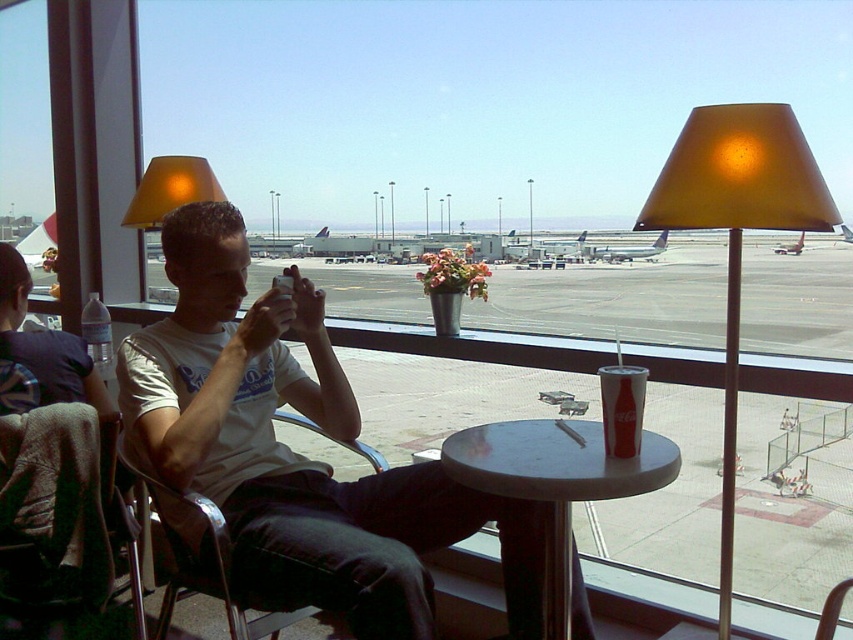
You are an airport photographer who needs to set up your equipment. You see the smooth gray table at center and the matte yellow lampshade at upper left. Which object is located to the right of the other?

The smooth gray table at center is positioned on the right side of matte yellow lampshade at upper left.